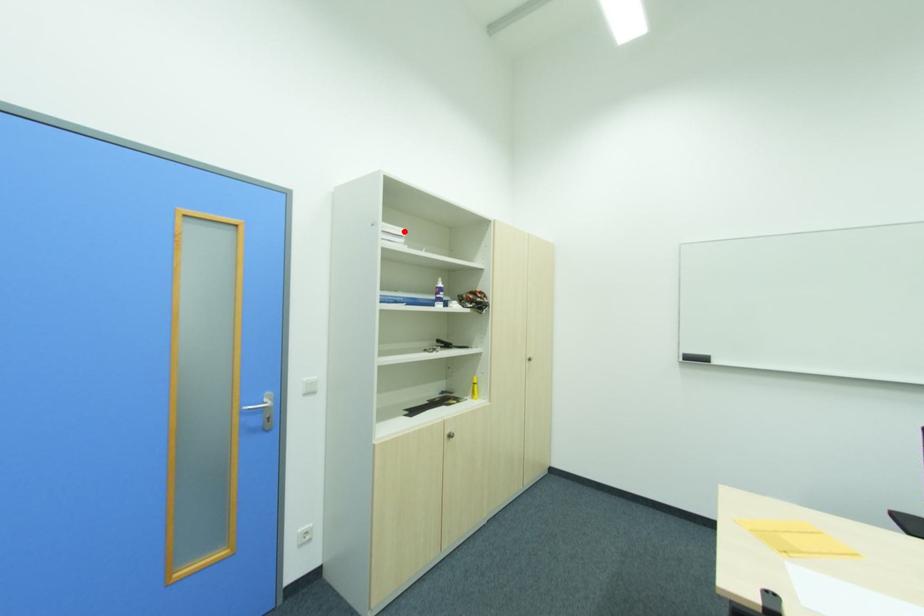
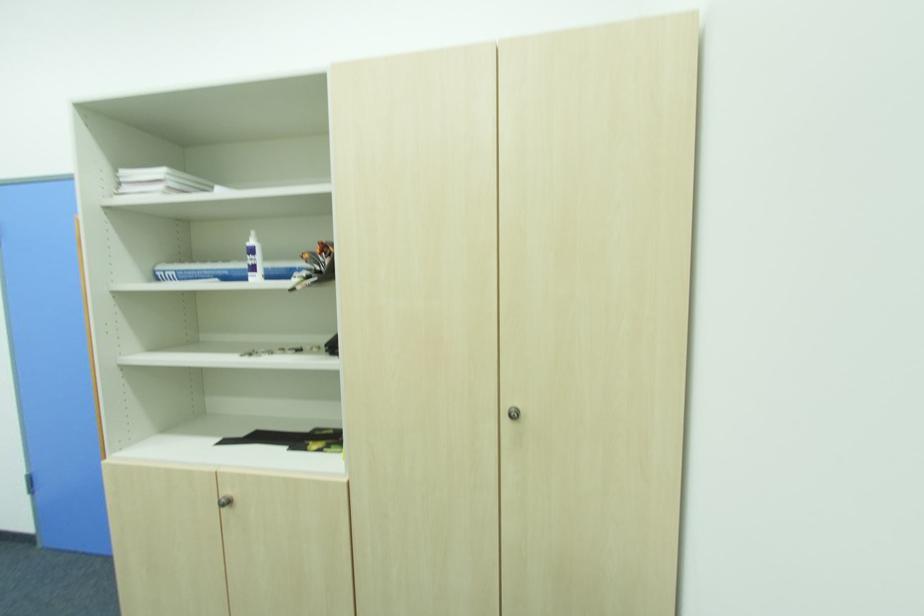
Locate, in the second image, the point that corresponds to the highlighted location in the first image.

(161, 172)